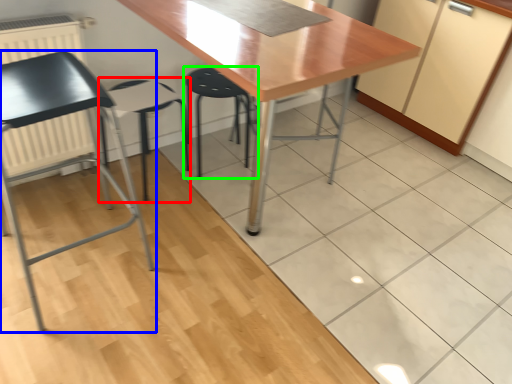
Question: Which object is positioned closest to folding chair (highlighted by a red box)? Select from chair (highlighted by a blue box) and step stool (highlighted by a green box).

Choices:
 (A) chair
 (B) step stool

Answer: (A)